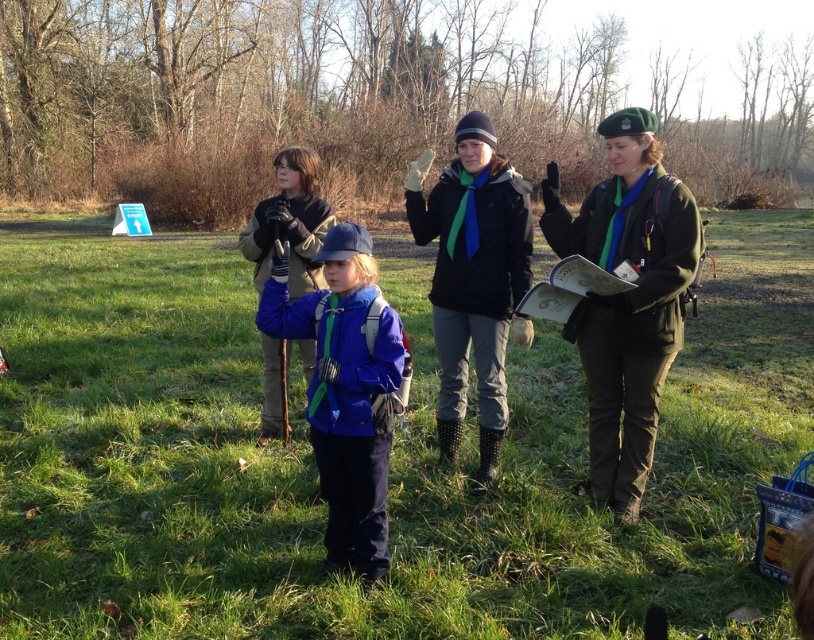
You are planning to set up a picnic blanket in the park. Given the presence of the green grass at center and the matte blue jacket at center, which location would be more suitable for placing the blanket?

The green grass at center is much taller than the matte blue jacket at center, so placing the picnic blanket on the green grass at center would be more suitable as it provides a level surface.

You are a photographer trying to capture a photo of the green fabric beret at right in the park scene. Based on its coordinates, where should you position your camera to ensure the beret is centered in the frame?

The green fabric beret at right is located at point coordinates 0.467 on the x and 0.771 on the y axis. To center it, position the camera so the beret is at the center of the frame using these coordinates.